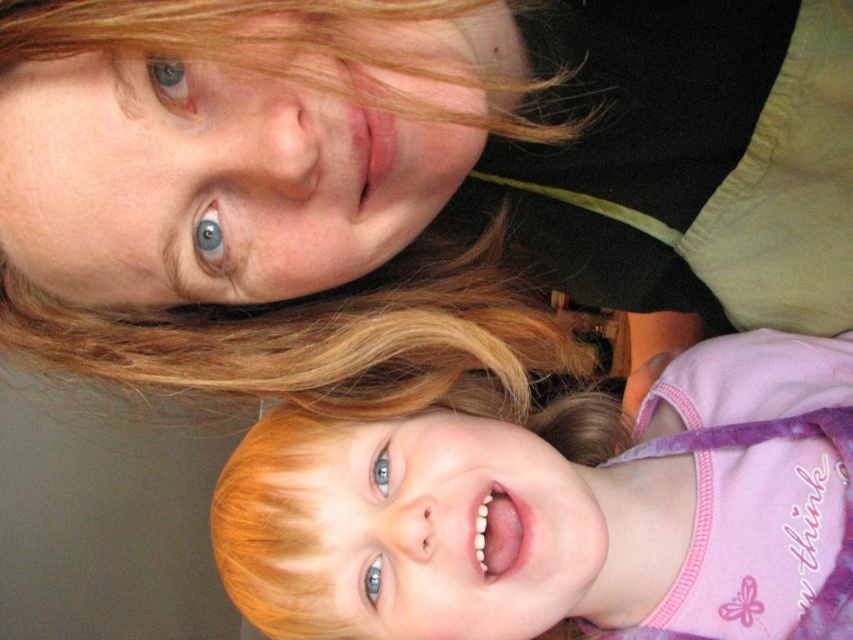
Does smooth blonde hair at lower center have a greater height compared to blonde hair at upper left?

Yes, smooth blonde hair at lower center is taller than blonde hair at upper left.

Is smooth blonde hair at lower center thinner than blonde hair at upper left?

Incorrect, smooth blonde hair at lower center's width is not less than blonde hair at upper left's.

Who is more distant from viewer, (438, 579) or (415, 314)?

The point (438, 579) is more distant.

The image size is (853, 640). I want to click on smooth blonde hair at lower center, so click(560, 513).